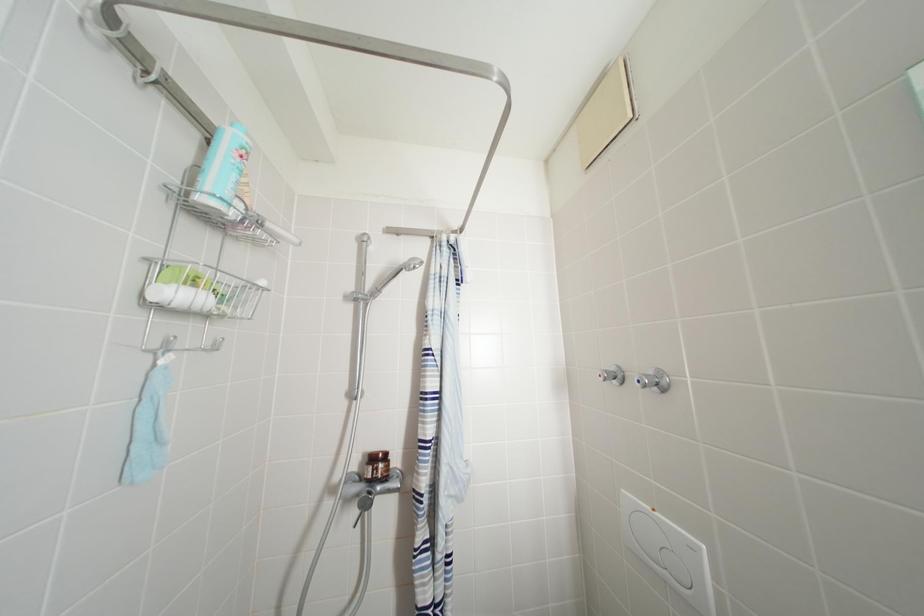
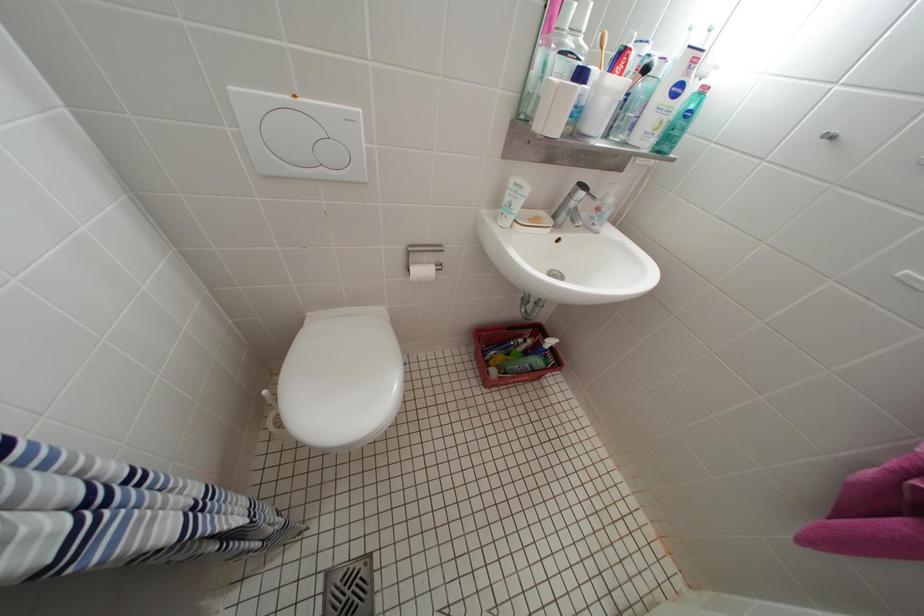
Based on the continuous images, in which direction is the camera rotating?

The camera's rotation is toward right-down.